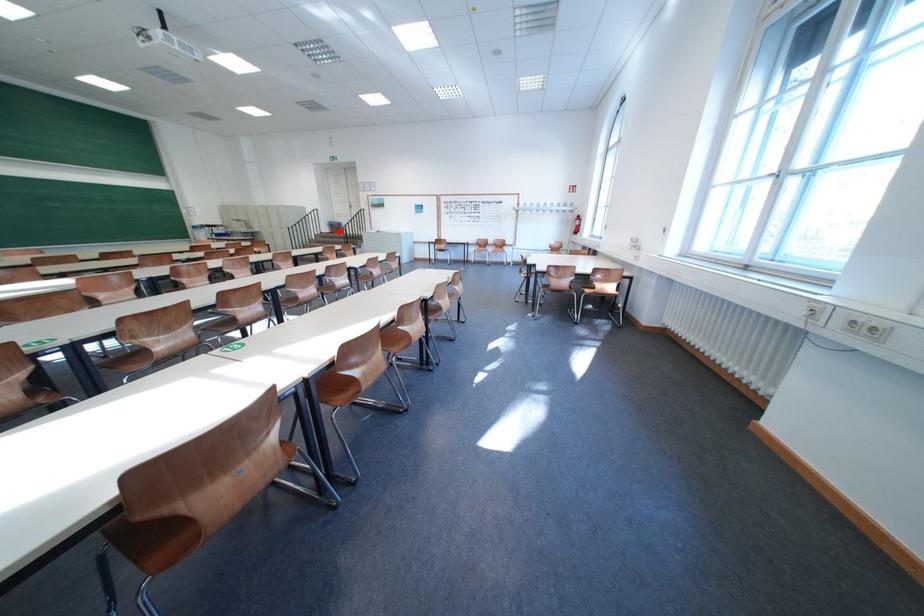
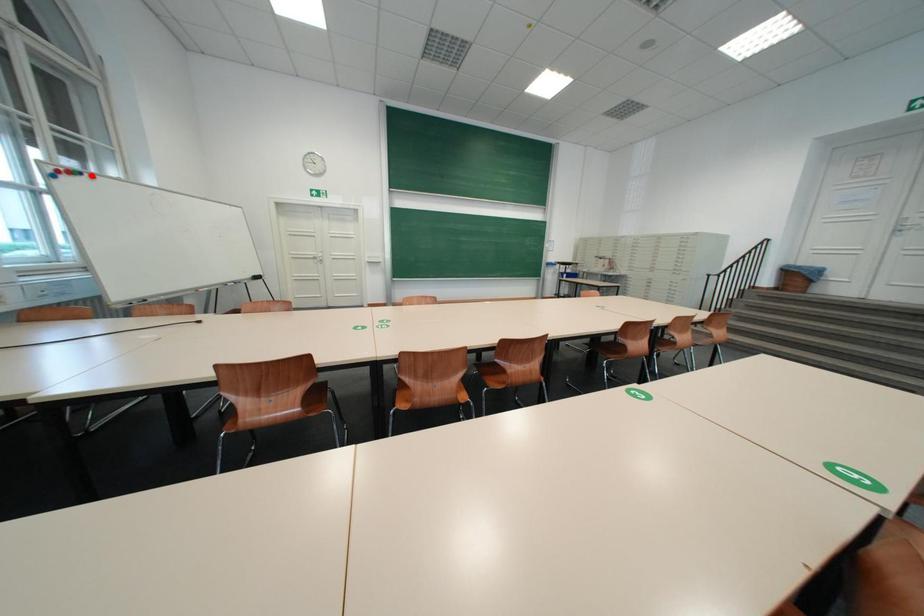
I am providing you with two images of the same scene from different viewpoints. A red point is marked on the first image and another point is marked on the second image. Is the red point in image1 aligned with the point shown in image2?

No